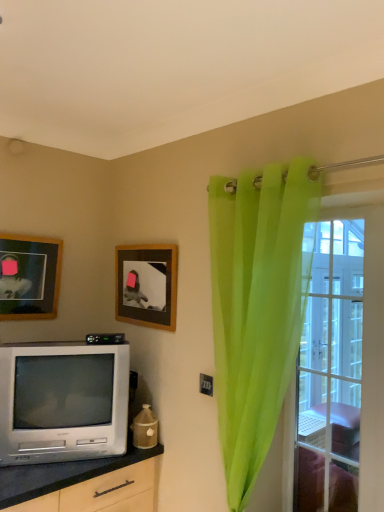
Question: Choose the correct answer: Is clear glass door at right inside translucent green curtain at right or outside it?

Choices:
 (A) outside
 (B) inside

Answer: (A)

Question: Considering the positions of clear glass door at right and translucent green curtain at right in the image, is clear glass door at right taller or shorter than translucent green curtain at right?

Choices:
 (A) tall
 (B) short

Answer: (B)

Question: Estimate the real-world distances between objects in this image. Which object is closer to the silver metallic television at lower left?

Choices:
 (A) translucent green curtain at right
 (B) wooden picture frame at upper center, marked as the 1th picture frame in a right-to-left arrangement
 (C) wooden picture frame at upper left, which appears as the 1th picture frame when viewed from the left
 (D) clear glass door at right

Answer: (B)

Question: Estimate the real-world distances between objects in this image. Which object is closer to the translucent green curtain at right?

Choices:
 (A) wooden picture frame at upper left, the second picture frame in the right-to-left sequence
 (B) wooden picture frame at upper center, marked as the 1th picture frame in a right-to-left arrangement
 (C) silver metallic television at lower left
 (D) clear glass door at right

Answer: (D)